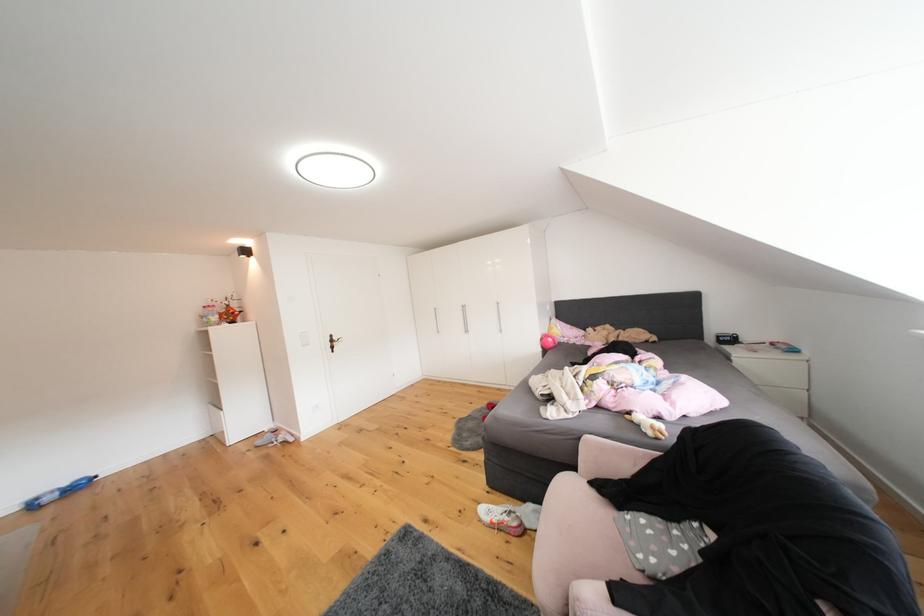
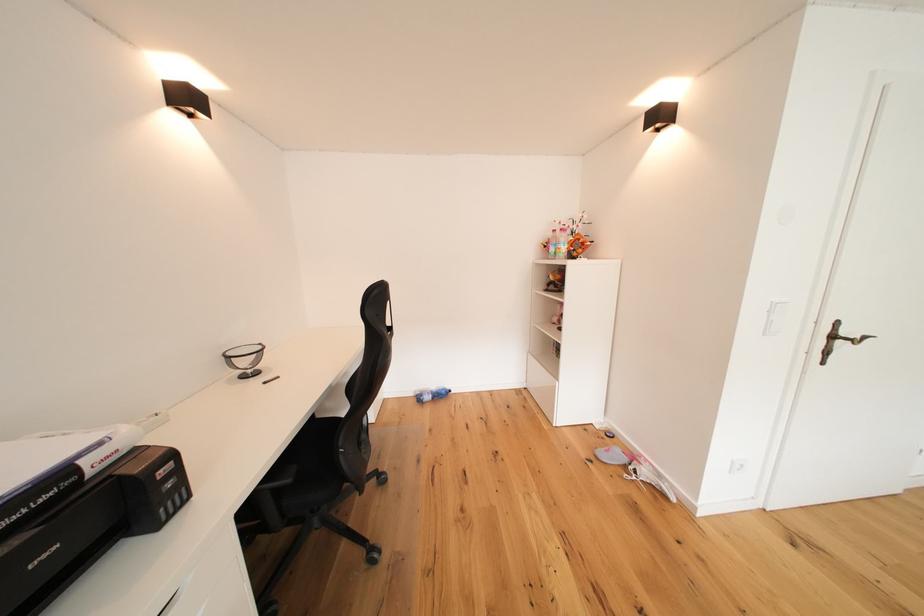
Find the pixel in the second image that matches point 341,345 in the first image.

(843, 339)